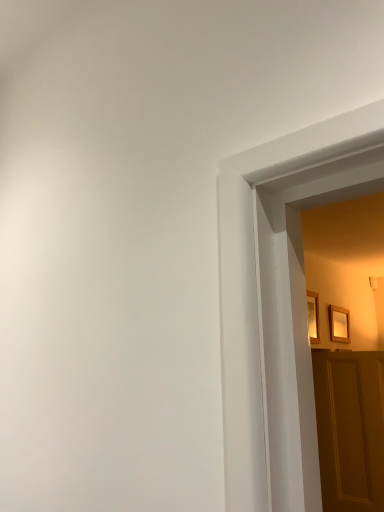
Question: Is wooden picture frame at upper right, marked as the first picture frame in a back-to-front arrangement, taller or shorter than wooden picture frame at upper right, the second picture frame from the right?

Choices:
 (A) tall
 (B) short

Answer: (B)

Question: Considering the positions of wooden picture frame at upper right, the 2th picture frame in the front-to-back sequence, and wooden picture frame at upper right, the second picture frame from the right, in the image, is wooden picture frame at upper right, the 2th picture frame in the front-to-back sequence, bigger or smaller than wooden picture frame at upper right, the second picture frame from the right,?

Choices:
 (A) big
 (B) small

Answer: (B)

Question: Which of these objects is positioned farthest from the wooden picture frame at upper right, the 2th picture frame in the front-to-back sequence?

Choices:
 (A) wooden panelled door at right
 (B) wooden picture frame at upper right, the 2th picture frame in the back-to-front sequence

Answer: (A)

Question: Which is nearer to the wooden picture frame at upper right, the 2th picture frame in the front-to-back sequence?

Choices:
 (A) wooden picture frame at upper right, acting as the 1th picture frame starting from the left
 (B) wooden panelled door at right

Answer: (A)